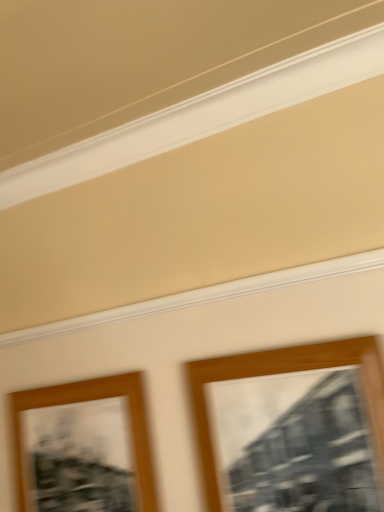
Question: Considering the relative positions of wooden picture frame at center, which appears as the 1th picture frame when viewed from the front, and wooden picture frame at lower left, which is the first picture frame from left to right, in the image provided, is wooden picture frame at center, which appears as the 1th picture frame when viewed from the front, to the left of wooden picture frame at lower left, which is the first picture frame from left to right, from the viewer's perspective?

Choices:
 (A) yes
 (B) no

Answer: (B)

Question: Can you confirm if wooden picture frame at center, the 1th picture frame from the right, is positioned to the right of wooden picture frame at lower left, which is the 1th picture frame in back-to-front order?

Choices:
 (A) no
 (B) yes

Answer: (B)

Question: Is wooden picture frame at center, which ranks as the second picture frame in left-to-right order, thinner than wooden picture frame at lower left, arranged as the 2th picture frame when viewed from the front?

Choices:
 (A) yes
 (B) no

Answer: (B)

Question: From a real-world perspective, is wooden picture frame at center, the 2th picture frame when ordered from back to front, physically above wooden picture frame at lower left, placed as the 2th picture frame when sorted from right to left?

Choices:
 (A) no
 (B) yes

Answer: (B)

Question: Does wooden picture frame at center, the 1th picture frame from the right, have a larger size compared to wooden picture frame at lower left, placed as the 2th picture frame when sorted from right to left?

Choices:
 (A) no
 (B) yes

Answer: (B)

Question: Is the depth of wooden picture frame at center, which appears as the 1th picture frame when viewed from the front, less than that of wooden picture frame at lower left, which is the first picture frame from left to right?

Choices:
 (A) yes
 (B) no

Answer: (A)

Question: Considering the relative sizes of wooden picture frame at lower left, arranged as the 2th picture frame when viewed from the front, and wooden picture frame at center, the 2th picture frame when ordered from back to front, in the image provided, is wooden picture frame at lower left, arranged as the 2th picture frame when viewed from the front, wider than wooden picture frame at center, the 2th picture frame when ordered from back to front,?

Choices:
 (A) no
 (B) yes

Answer: (A)

Question: Can you confirm if wooden picture frame at lower left, which is the 1th picture frame in back-to-front order, is smaller than wooden picture frame at center, the 1th picture frame from the right?

Choices:
 (A) yes
 (B) no

Answer: (A)

Question: Are wooden picture frame at lower left, which is the first picture frame from left to right, and wooden picture frame at center, which appears as the 1th picture frame when viewed from the front, far apart?

Choices:
 (A) no
 (B) yes

Answer: (A)

Question: Considering the relative sizes of wooden picture frame at lower left, which is the 1th picture frame in back-to-front order, and wooden picture frame at center, the 2th picture frame when ordered from back to front, in the image provided, is wooden picture frame at lower left, which is the 1th picture frame in back-to-front order, thinner than wooden picture frame at center, the 2th picture frame when ordered from back to front,?

Choices:
 (A) no
 (B) yes

Answer: (B)

Question: Considering the relative positions of wooden picture frame at lower left, arranged as the 2th picture frame when viewed from the front, and wooden picture frame at center, the 2th picture frame when ordered from back to front, in the image provided, is wooden picture frame at lower left, arranged as the 2th picture frame when viewed from the front, to the right of wooden picture frame at center, the 2th picture frame when ordered from back to front, from the viewer's perspective?

Choices:
 (A) no
 (B) yes

Answer: (A)

Question: From the image's perspective, is wooden picture frame at lower left, which is the first picture frame from left to right, above wooden picture frame at center, the 1th picture frame from the right?

Choices:
 (A) yes
 (B) no

Answer: (B)

Question: In the image, is wooden picture frame at center, the 1th picture frame from the right, positioned in front of or behind wooden picture frame at lower left, placed as the 2th picture frame when sorted from right to left?

Choices:
 (A) front
 (B) behind

Answer: (A)